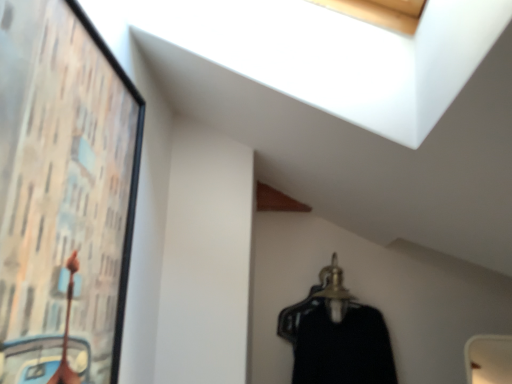
Image resolution: width=512 pixels, height=384 pixels. Find the location of `black matte dress at center`. black matte dress at center is located at coordinates (337, 342).

In order to face gold metallic hanger at lower center, should I rotate leftwards or rightwards?

You should rotate right by 10.306 degrees.

Find the location of a particular element. black matte dress at center is located at coordinates (337, 342).

Would you say black matte dress at center is a long distance from wooden framed artwork at left?

Absolutely, black matte dress at center is distant from wooden framed artwork at left.

Consider the image. Is black matte dress at center aimed at wooden framed artwork at left?

No, black matte dress at center is not aimed at wooden framed artwork at left.

Is black matte dress at center shorter than wooden framed artwork at left?

Indeed, black matte dress at center has a lesser height compared to wooden framed artwork at left.

Are wooden framed artwork at left and gold metallic hanger at lower center beside each other?

No, wooden framed artwork at left is not making contact with gold metallic hanger at lower center.

Does point (28, 348) come behind point (338, 298)?

No, (28, 348) is in front of (338, 298).

From a real-world perspective, is wooden framed artwork at left under gold metallic hanger at lower center?

No, from a real-world perspective, wooden framed artwork at left is not under gold metallic hanger at lower center.

Are wooden framed artwork at left and black matte dress at center making contact?

No, wooden framed artwork at left is not with black matte dress at center.

Is the position of wooden framed artwork at left more distant than that of black matte dress at center?

No, it is in front of black matte dress at center.

How distant is wooden framed artwork at left from black matte dress at center?

A distance of 3.41 feet exists between wooden framed artwork at left and black matte dress at center.

Based on the photo, from a real-world perspective, who is located lower, wooden framed artwork at left or black matte dress at center?

From a 3D spatial view, black matte dress at center is below.

Based on their sizes in the image, would you say gold metallic hanger at lower center is bigger or smaller than black matte dress at center?

Clearly, gold metallic hanger at lower center is smaller in size than black matte dress at center.

From the image's perspective, which one is positioned higher, gold metallic hanger at lower center or black matte dress at center?

gold metallic hanger at lower center, from the image's perspective.

Considering the sizes of objects gold metallic hanger at lower center and black matte dress at center in the image provided, who is thinner, gold metallic hanger at lower center or black matte dress at center?

With smaller width is black matte dress at center.

The height and width of the screenshot is (384, 512). I want to click on clothing that is on the right side of gold metallic hanger at lower center, so click(x=337, y=342).

In terms of width, does black matte dress at center look wider or thinner when compared to gold metallic hanger at lower center?

Clearly, black matte dress at center has less width compared to gold metallic hanger at lower center.

From the image's perspective, which is above, black matte dress at center or gold metallic hanger at lower center?

gold metallic hanger at lower center appears higher in the image.

Considering the points (378, 336) and (343, 294), which point is in front, point (378, 336) or point (343, 294)?

The point (378, 336) is closer to the camera.

Is gold metallic hanger at lower center turned away from wooden framed artwork at left?

gold metallic hanger at lower center is not turned away from wooden framed artwork at left.

Can you confirm if gold metallic hanger at lower center is positioned to the right of wooden framed artwork at left?

Indeed, gold metallic hanger at lower center is positioned on the right side of wooden framed artwork at left.

Consider the image. Which object is more forward, gold metallic hanger at lower center or wooden framed artwork at left?

wooden framed artwork at left is in front.

Locate an element on the screen. picture frame above the black matte dress at center (from the image's perspective) is located at coordinates (63, 193).

Image resolution: width=512 pixels, height=384 pixels. There is a gold metallic hanger at lower center. Identify the location of picture frame above it (from a real-world perspective). (63, 193).

Estimate the real-world distances between objects in this image. Which object is further from gold metallic hanger at lower center, black matte dress at center or wooden framed artwork at left?

wooden framed artwork at left lies further to gold metallic hanger at lower center than the other object.

When comparing their distances from wooden framed artwork at left, does gold metallic hanger at lower center or black matte dress at center seem closer?

Based on the image, black matte dress at center appears to be nearer to wooden framed artwork at left.

Consider the image. From the image, which object appears to be farther from black matte dress at center, wooden framed artwork at left or gold metallic hanger at lower center?

The object further to black matte dress at center is wooden framed artwork at left.

From the image, which object appears to be farther from gold metallic hanger at lower center, wooden framed artwork at left or black matte dress at center?

wooden framed artwork at left is further to gold metallic hanger at lower center.

Which object lies nearer to the anchor point wooden framed artwork at left, black matte dress at center or gold metallic hanger at lower center?

Among the two, black matte dress at center is located nearer to wooden framed artwork at left.

Considering their positions, is gold metallic hanger at lower center positioned further to black matte dress at center than wooden framed artwork at left?

Among the two, wooden framed artwork at left is located further to black matte dress at center.

Where is `clothing between wooden framed artwork at left and gold metallic hanger at lower center along the z-axis`? The image size is (512, 384). clothing between wooden framed artwork at left and gold metallic hanger at lower center along the z-axis is located at coordinates (337, 342).